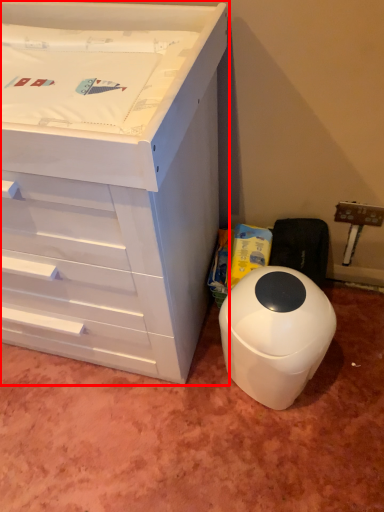
Question: From the image's perspective, where is chest of drawers (annotated by the red box) located relative to waste container?

Choices:
 (A) below
 (B) above

Answer: (B)